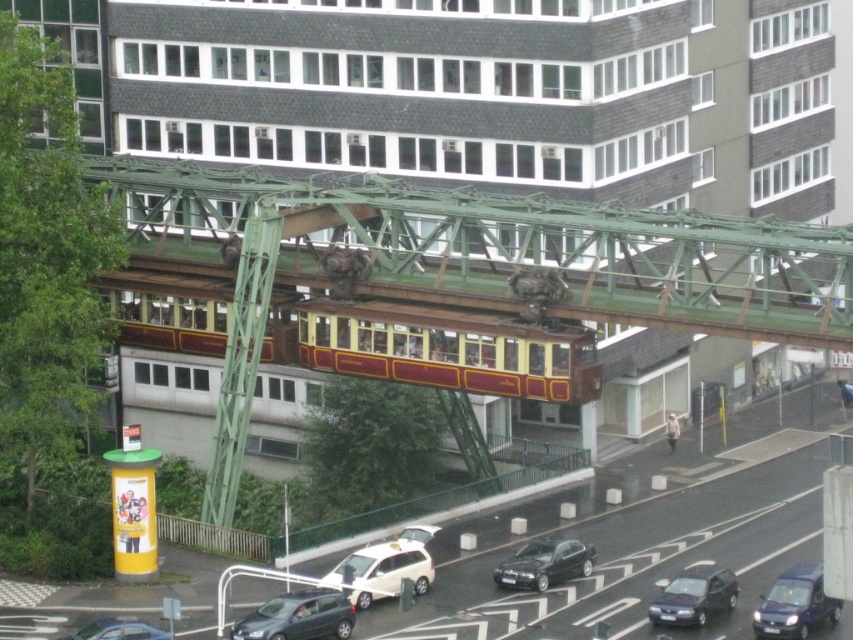
Question: Does white matte van at lower center have a smaller size compared to metallic blue van at lower right?

Choices:
 (A) yes
 (B) no

Answer: (B)

Question: Does white matte van at lower center appear under metallic blue van at lower right?

Choices:
 (A) no
 (B) yes

Answer: (A)

Question: Which object is the closest to the matte gray car at lower left?

Choices:
 (A) white matte van at lower center
 (B) metallic gray car at lower left
 (C) green metallic bridge at center
 (D) metallic blue van at lower right

Answer: (B)

Question: Which of the following is the farthest from the observer?

Choices:
 (A) (468, 378)
 (B) (366, 552)

Answer: (A)

Question: Is metallic blue van at lower right smaller than matte black car at lower right?

Choices:
 (A) no
 (B) yes

Answer: (A)

Question: Among these objects, which one is nearest to the camera?

Choices:
 (A) white matte van at lower center
 (B) metallic blue van at lower right
 (C) matte black car at lower right
 (D) shiny black car at lower center

Answer: (B)